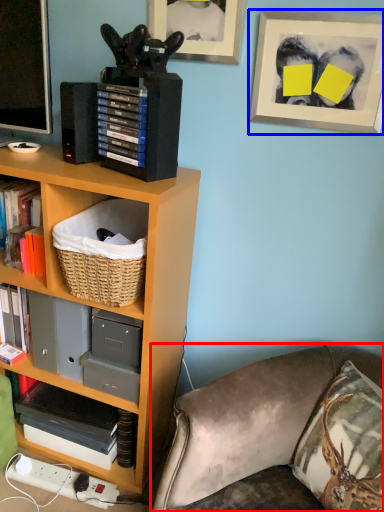
Question: Among these objects, which one is farthest to the camera, studio couch (highlighted by a red box) or picture frame (highlighted by a blue box)?

Choices:
 (A) studio couch
 (B) picture frame

Answer: (B)